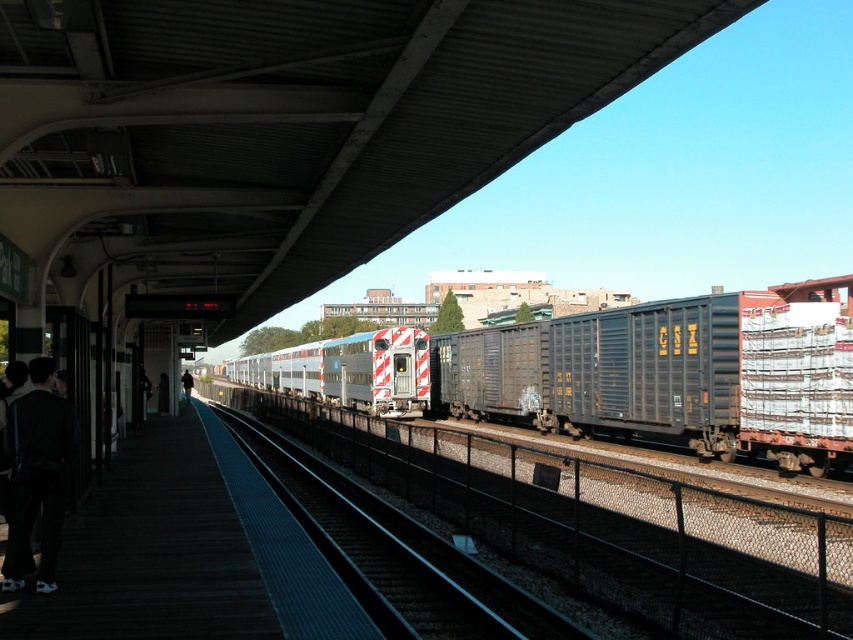
Is dark wood platform at lower left to the left of black leather jacket at lower left from the viewer's perspective?

No, dark wood platform at lower left is not to the left of black leather jacket at lower left.

Which is below, dark wood platform at lower left or black leather jacket at lower left?

black leather jacket at lower left

Where is `dark wood platform at lower left`? Image resolution: width=853 pixels, height=640 pixels. dark wood platform at lower left is located at coordinates (187, 554).

Which of these two, dark wood platform at lower left or dark gray pants at left, stands shorter?

With less height is dark wood platform at lower left.

Is dark wood platform at lower left smaller than dark gray pants at left?

No.

Identify the location of dark wood platform at lower left. The width and height of the screenshot is (853, 640). (187, 554).

You are a GUI agent. You are given a task and a screenshot of the screen. Output one action in this format:
    pyautogui.click(x=<x>, y=<y>)
    Task: Click on the black metal train track at center
    This screenshot has width=853, height=640.
    Given the screenshot: What is the action you would take?
    pyautogui.click(x=395, y=552)

Between black metal train track at center and dark gray pants at left, which one is positioned higher?

Positioned higher is dark gray pants at left.

Does point (380, 600) lie behind point (32, 508)?

Yes.

The width and height of the screenshot is (853, 640). I want to click on black metal train track at center, so click(x=395, y=552).